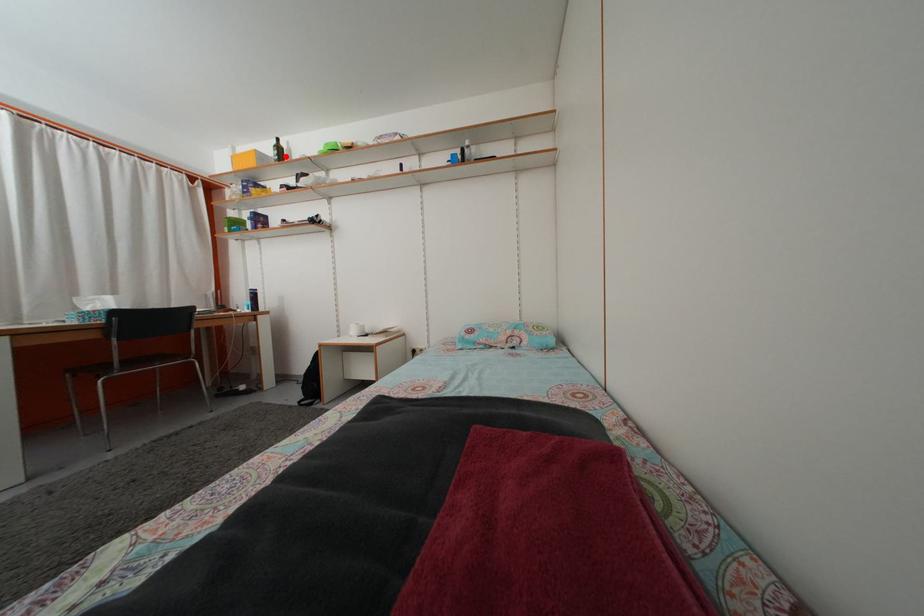
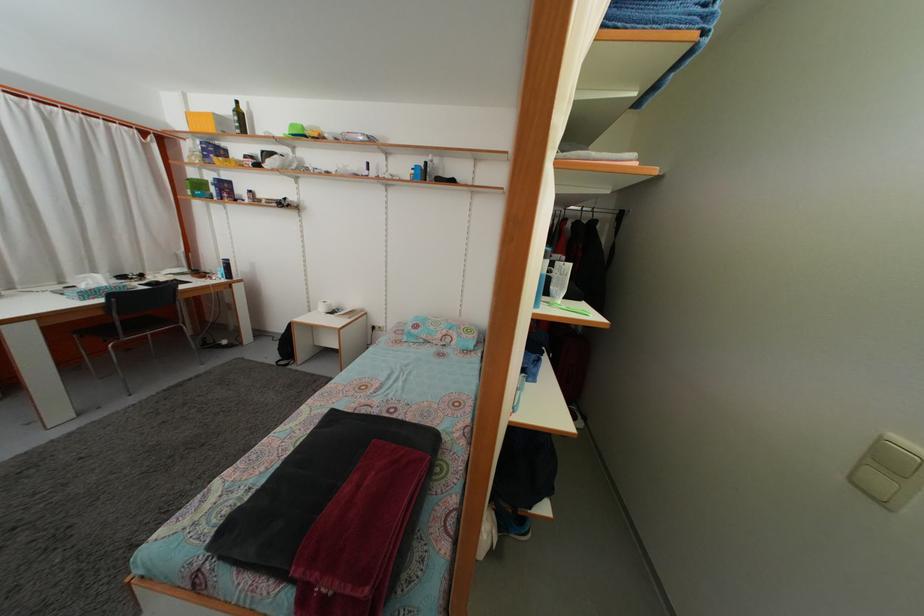
Find the pixel in the second image that matches the highlighted location in the first image.

(246, 122)